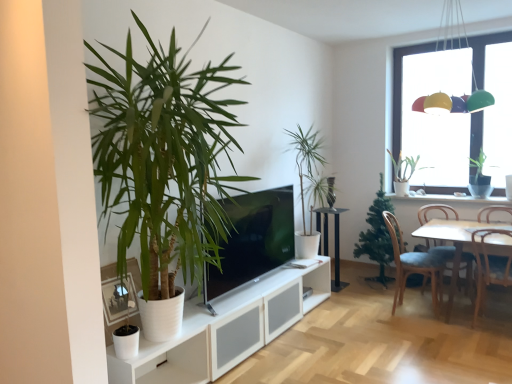
At what (x,y) coordinates should I click in order to perform the action: click on free point behind blue fabric chair at lower right, which is the fourth chair from right to left. Please return your answer as a coordinate pair (x, y). This screenshot has width=512, height=384. Looking at the image, I should click on (392, 296).